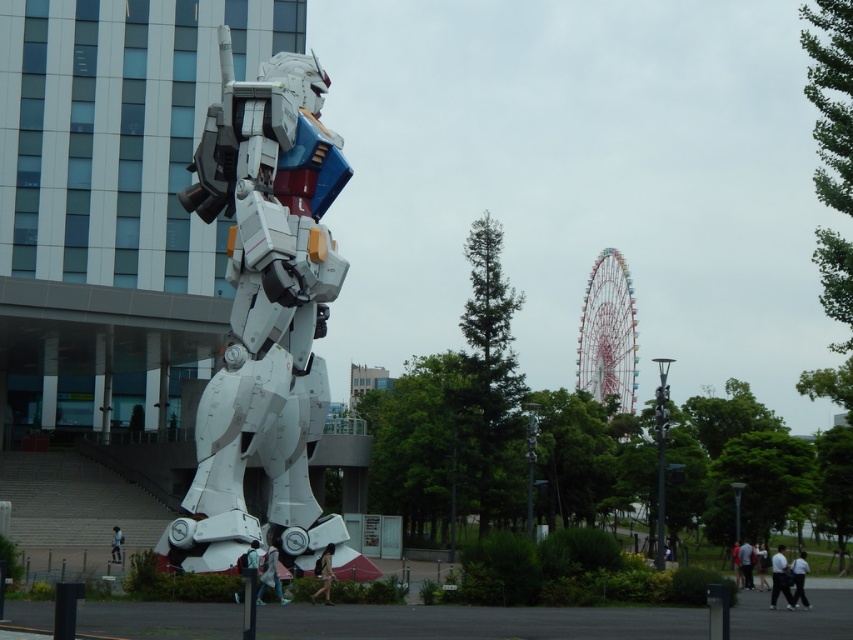
Question: Which object is the farthest from the white metallic robot at center?

Choices:
 (A) white fabric shirt at lower right
 (B) light blue fabric backpack at lower center

Answer: (A)

Question: Which object appears closest to the camera in this image?

Choices:
 (A) light blue fabric jacket at center
 (B) white matte shirt at lower right
 (C) light brown leather jacket at lower center
 (D) light blue fabric backpack at lower center

Answer: (D)

Question: Is white fabric shirt at lower right to the left of light blue fabric jacket at center from the viewer's perspective?

Choices:
 (A) no
 (B) yes

Answer: (A)

Question: Where is light brown leather jacket at lower center located in relation to light blue shirt at lower right in the image?

Choices:
 (A) left
 (B) right

Answer: (A)

Question: Estimate the real-world distances between objects in this image. Which object is farther from the white metallic robot at center?

Choices:
 (A) light blue shirt at lower right
 (B) light brown leather jacket at lower center
 (C) white fabric shirt at lower right

Answer: (A)

Question: Is white fabric shirt at lower right to the right of white matte shirt at lower right from the viewer's perspective?

Choices:
 (A) no
 (B) yes

Answer: (A)